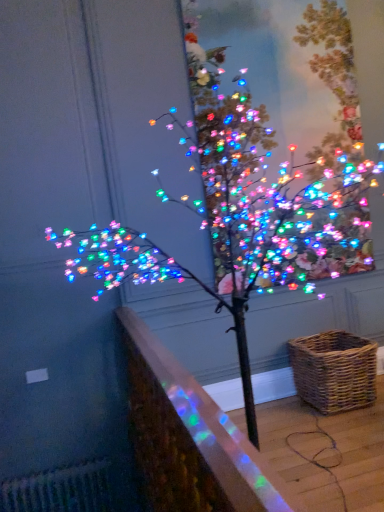
The height and width of the screenshot is (512, 384). I want to click on translucent glass railing at lower left, so click(189, 437).

At what (x,y) coordinates should I click in order to perform the action: click on woven brown picnic basket at lower right. Please return your answer as a coordinate pair (x, y). The image size is (384, 512). Looking at the image, I should click on (334, 371).

This screenshot has height=512, width=384. What are the coordinates of `translucent glass railing at lower left` in the screenshot? It's located at (189, 437).

Locate an element on the screen. christmas tree lying on the left of woven brown picnic basket at lower right is located at coordinates (270, 187).

Considering the sizes of woven brown picnic basket at lower right and multicolored lights at upper center in the image, is woven brown picnic basket at lower right taller or shorter than multicolored lights at upper center?

Clearly, woven brown picnic basket at lower right is shorter compared to multicolored lights at upper center.

Which is further, (x=347, y=386) or (x=261, y=137)?

The point (x=261, y=137) is farther.

Is woven brown picnic basket at lower right positioned behind translucent glass railing at lower left?

Yes, woven brown picnic basket at lower right is behind translucent glass railing at lower left.

Is woven brown picnic basket at lower right oriented towards translucent glass railing at lower left?

No, woven brown picnic basket at lower right does not turn towards translucent glass railing at lower left.

Does woven brown picnic basket at lower right have a larger size compared to translucent glass railing at lower left?

No, woven brown picnic basket at lower right is not bigger than translucent glass railing at lower left.

From a real-world perspective, is woven brown picnic basket at lower right on top of translucent glass railing at lower left?

Actually, woven brown picnic basket at lower right is physically below translucent glass railing at lower left in the real world.

Is translucent glass railing at lower left next to woven brown picnic basket at lower right and touching it?

No, translucent glass railing at lower left is not beside woven brown picnic basket at lower right.

Based on the photo, is translucent glass railing at lower left to the left of woven brown picnic basket at lower right from the viewer's perspective?

Yes, translucent glass railing at lower left is to the left of woven brown picnic basket at lower right.

Can you confirm if translucent glass railing at lower left is shorter than woven brown picnic basket at lower right?

No, translucent glass railing at lower left is not shorter than woven brown picnic basket at lower right.

Does translucent glass railing at lower left have a greater width compared to woven brown picnic basket at lower right?

In fact, translucent glass railing at lower left might be narrower than woven brown picnic basket at lower right.

Considering the sizes of objects translucent glass railing at lower left and multicolored lights at upper center in the image provided, who is smaller, translucent glass railing at lower left or multicolored lights at upper center?

multicolored lights at upper center.

Between point (188, 461) and point (204, 180), which one is positioned behind?

The point (204, 180) is more distant.

Between translucent glass railing at lower left and multicolored lights at upper center, which one has larger width?

translucent glass railing at lower left is wider.

Does translucent glass railing at lower left appear on the right side of multicolored lights at upper center?

No.

Locate an element on the screen. christmas tree behind the translucent glass railing at lower left is located at coordinates (270, 187).

From a real-world perspective, which is physically below, multicolored lights at upper center or translucent glass railing at lower left?

translucent glass railing at lower left is physically lower.

Considering the points (311, 191) and (247, 505), which point is behind, point (311, 191) or point (247, 505)?

The point (311, 191) is farther from the camera.

Is multicolored lights at upper center facing towards translucent glass railing at lower left?

No, multicolored lights at upper center is not turned towards translucent glass railing at lower left.

Is the surface of multicolored lights at upper center in direct contact with woven brown picnic basket at lower right?

No.

Based on their sizes in the image, would you say multicolored lights at upper center is bigger or smaller than woven brown picnic basket at lower right?

multicolored lights at upper center is bigger than woven brown picnic basket at lower right.

Can you confirm if multicolored lights at upper center is taller than woven brown picnic basket at lower right?

Yes, multicolored lights at upper center is taller than woven brown picnic basket at lower right.

How many degrees apart are the facing directions of multicolored lights at upper center and woven brown picnic basket at lower right?

multicolored lights at upper center and woven brown picnic basket at lower right are facing 88.6 degrees away from each other.

You are a GUI agent. You are given a task and a screenshot of the screen. Output one action in this format:
    pyautogui.click(x=<x>, y=<y>)
    Task: Click on the christmas tree behind the woven brown picnic basket at lower right
    
    Given the screenshot: What is the action you would take?
    pyautogui.click(x=270, y=187)

Identify the location of ledge on the left of woven brown picnic basket at lower right. The image size is (384, 512). (189, 437).

Based on their spatial positions, is translucent glass railing at lower left or multicolored lights at upper center further from woven brown picnic basket at lower right?

translucent glass railing at lower left.

Consider the image. Estimate the real-world distances between objects in this image. Which object is closer to translucent glass railing at lower left, multicolored lights at upper center or woven brown picnic basket at lower right?

multicolored lights at upper center.

Based on their spatial positions, is translucent glass railing at lower left or woven brown picnic basket at lower right closer to multicolored lights at upper center?

woven brown picnic basket at lower right is positioned closer to the anchor multicolored lights at upper center.

Based on their spatial positions, is woven brown picnic basket at lower right or translucent glass railing at lower left further from multicolored lights at upper center?

Based on the image, translucent glass railing at lower left appears to be further to multicolored lights at upper center.

Based on their spatial positions, is multicolored lights at upper center or translucent glass railing at lower left closer to woven brown picnic basket at lower right?

multicolored lights at upper center lies closer to woven brown picnic basket at lower right than the other object.

Which object lies nearer to the anchor point translucent glass railing at lower left, woven brown picnic basket at lower right or multicolored lights at upper center?

multicolored lights at upper center lies closer to translucent glass railing at lower left than the other object.

Identify the location of picnic basket between translucent glass railing at lower left and multicolored lights at upper center in the front-back direction. The width and height of the screenshot is (384, 512). (334, 371).